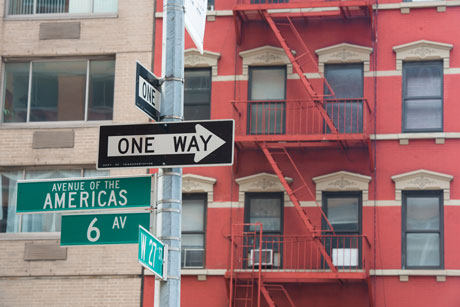
The image size is (460, 307). In order to click on window in this screenshot , I will do `click(357, 122)`.